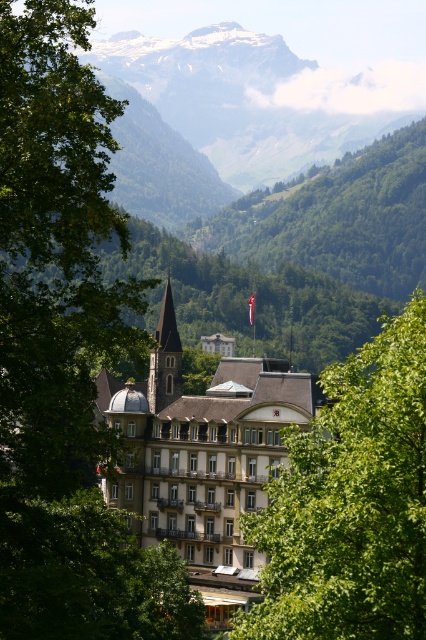
Question: Which point is farther to the camera?

Choices:
 (A) (271, 545)
 (B) (71, 476)
 (C) (284, 396)

Answer: (C)

Question: Can you confirm if green leafy tree at center is bigger than green grassy mountain at upper center?

Choices:
 (A) yes
 (B) no

Answer: (A)

Question: Which object is farther from the camera taking this photo?

Choices:
 (A) green grassy mountain at upper center
 (B) green leafy tree at left
 (C) green leafy tree at center
 (D) brown stone hotel at center

Answer: (A)

Question: Does green leafy tree at center have a larger size compared to brown stone hotel at center?

Choices:
 (A) no
 (B) yes

Answer: (B)

Question: From the image, what is the correct spatial relationship of green leafy tree at left in relation to green grassy mountain at upper center?

Choices:
 (A) above
 (B) below

Answer: (B)

Question: Which object is the closest to the green leafy tree at center?

Choices:
 (A) green leafy tree at left
 (B) green grassy mountain at upper center

Answer: (A)